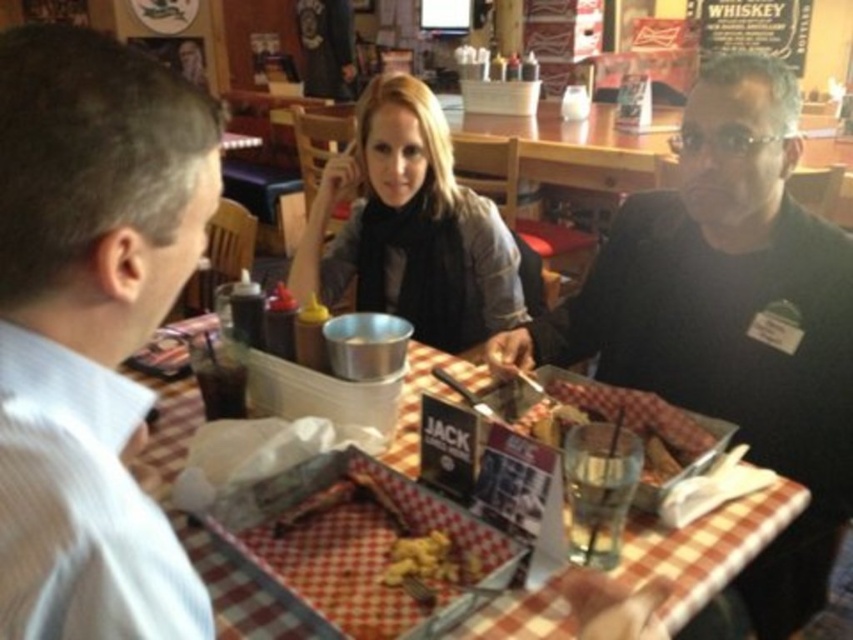
Question: Which point is farther to the camera?

Choices:
 (A) (399, 253)
 (B) (637, 256)
 (C) (57, 180)
 (D) (405, 394)

Answer: (A)

Question: Which of the following is the closest to the observer?

Choices:
 (A) golden crispy nuggets at center
 (B) checkered plastic tray at center
 (C) matte black scarf at center
 (D) black matte shirt at center

Answer: (A)

Question: Does black matte shirt at center appear over checkered plastic tray at center?

Choices:
 (A) yes
 (B) no

Answer: (A)

Question: Does white shirt at left have a larger size compared to checkered plastic tray at center?

Choices:
 (A) no
 (B) yes

Answer: (A)

Question: Among these objects, which one is farthest from the camera?

Choices:
 (A) black matte shirt at center
 (B) checkered plastic tray at center
 (C) matte black scarf at center
 (D) golden crispy nuggets at center

Answer: (C)

Question: Can you confirm if black matte shirt at center is positioned to the left of matte black scarf at center?

Choices:
 (A) yes
 (B) no

Answer: (B)